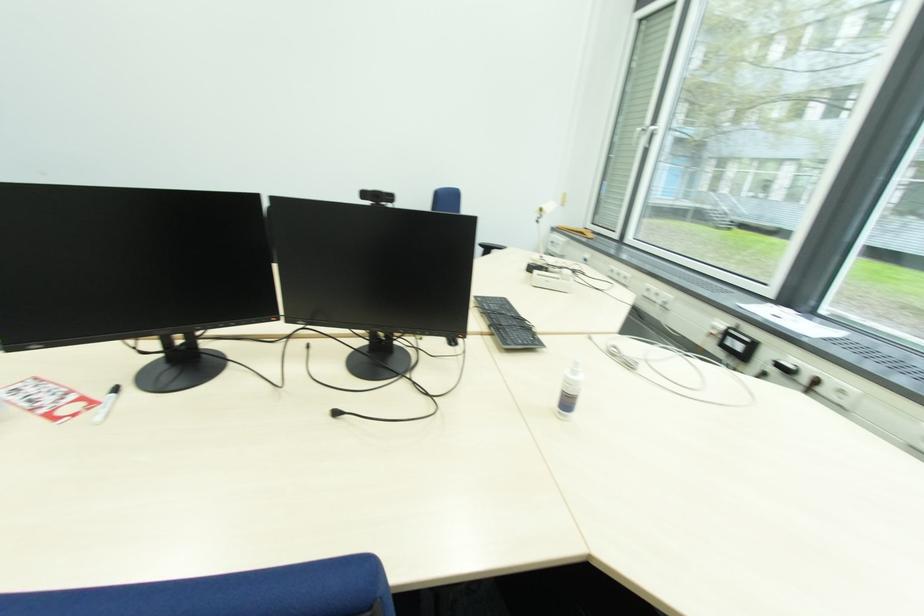
Which object does [377,197] point to?

It refers to a black webcam.